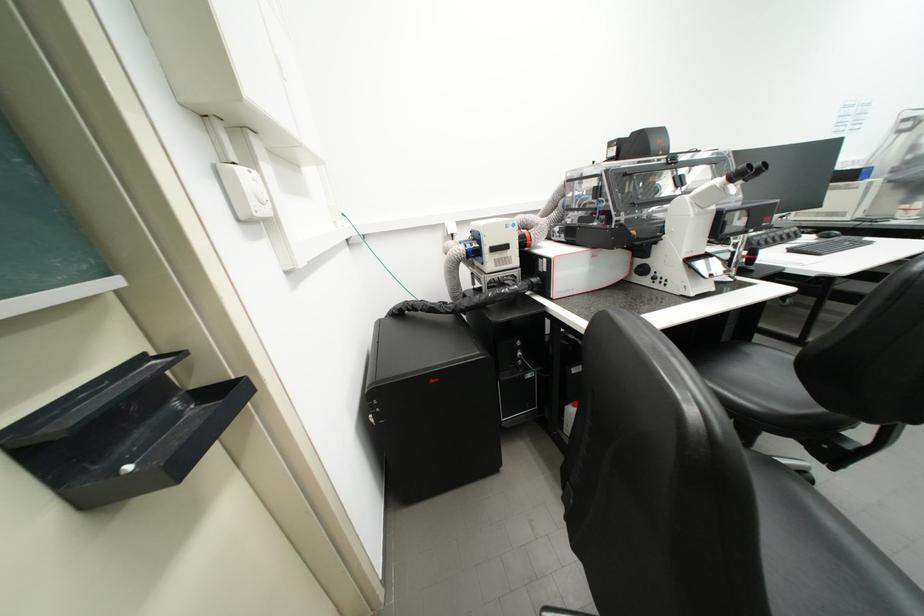
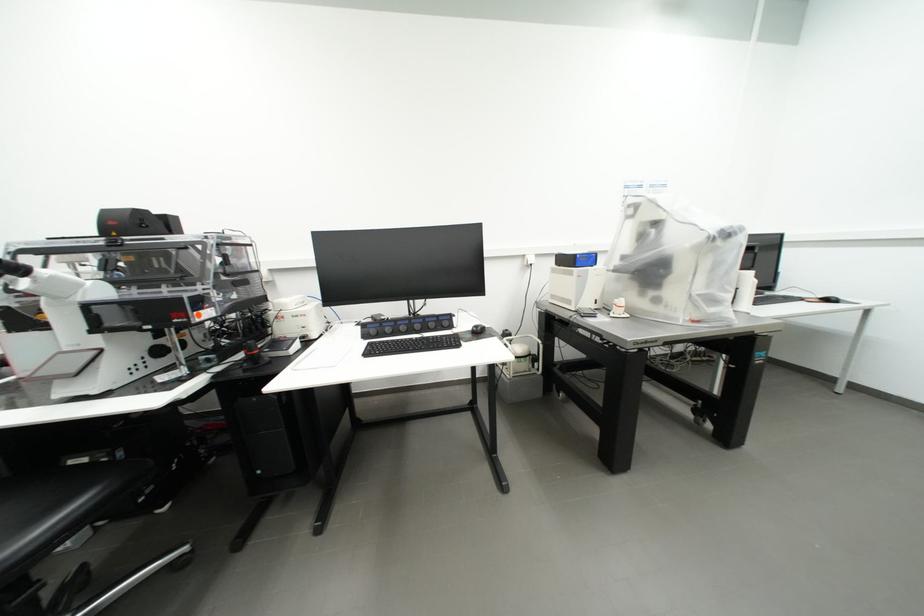
Question: Which direction would the cameraman need to move to produce the second image? Reply with the corresponding letter.

Choices:
 (A) Left
 (B) Right
 (C) Forward
 (D) Backward

Answer: (B)